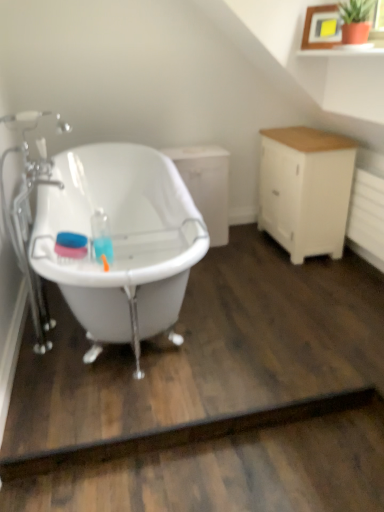
Question: From a real-world perspective, is white matte cabinet at center, which ranks as the 1th cabinetry in left-to-right order, physically below white glossy bathtub at left?

Choices:
 (A) yes
 (B) no

Answer: (A)

Question: Considering the relative sizes of white matte cabinet at center, positioned as the 2th cabinetry in right-to-left order, and white glossy bathtub at left in the image provided, is white matte cabinet at center, positioned as the 2th cabinetry in right-to-left order, wider than white glossy bathtub at left?

Choices:
 (A) yes
 (B) no

Answer: (B)

Question: Is white matte cabinet at center, which ranks as the 1th cabinetry in left-to-right order, shorter than white glossy bathtub at left?

Choices:
 (A) no
 (B) yes

Answer: (B)

Question: Is the depth of white matte cabinet at center, positioned as the 2th cabinetry in right-to-left order, greater than that of white glossy bathtub at left?

Choices:
 (A) no
 (B) yes

Answer: (B)

Question: Is white matte cabinet at center, which ranks as the 1th cabinetry in left-to-right order, at the right side of white glossy bathtub at left?

Choices:
 (A) no
 (B) yes

Answer: (B)

Question: Is white wood cabinet at right, marked as the 2th cabinetry in a left-to-right arrangement, wider or thinner than dark brown wood at lower center?

Choices:
 (A) wide
 (B) thin

Answer: (A)

Question: Is white wood cabinet at right, the first cabinetry viewed from the right, to the left or to the right of dark brown wood at lower center in the image?

Choices:
 (A) left
 (B) right

Answer: (B)

Question: Based on their sizes in the image, would you say white wood cabinet at right, marked as the 2th cabinetry in a left-to-right arrangement, is bigger or smaller than dark brown wood at lower center?

Choices:
 (A) small
 (B) big

Answer: (B)

Question: From the image's perspective, relative to dark brown wood at lower center, is white wood cabinet at right, marked as the 2th cabinetry in a left-to-right arrangement, above or below?

Choices:
 (A) below
 (B) above

Answer: (B)

Question: From a real-world perspective, is dark brown wood at lower center physically located above or below white matte cabinet at center, positioned as the 2th cabinetry in right-to-left order?

Choices:
 (A) below
 (B) above

Answer: (A)

Question: Is point (66, 449) closer or farther from the camera than point (218, 166)?

Choices:
 (A) closer
 (B) farther

Answer: (A)

Question: Is dark brown wood at lower center bigger or smaller than white matte cabinet at center, positioned as the 2th cabinetry in right-to-left order?

Choices:
 (A) small
 (B) big

Answer: (A)

Question: Do you think dark brown wood at lower center is within white matte cabinet at center, which ranks as the 1th cabinetry in left-to-right order, or outside of it?

Choices:
 (A) outside
 (B) inside

Answer: (A)

Question: Considering the positions of white matte cabinet at center, which ranks as the 1th cabinetry in left-to-right order, and white wood cabinet at right, the first cabinetry viewed from the right, in the image, is white matte cabinet at center, which ranks as the 1th cabinetry in left-to-right order, wider or thinner than white wood cabinet at right, the first cabinetry viewed from the right,?

Choices:
 (A) thin
 (B) wide

Answer: (B)

Question: From a real-world perspective, is white matte cabinet at center, positioned as the 2th cabinetry in right-to-left order, above or below white wood cabinet at right, marked as the 2th cabinetry in a left-to-right arrangement?

Choices:
 (A) above
 (B) below

Answer: (B)